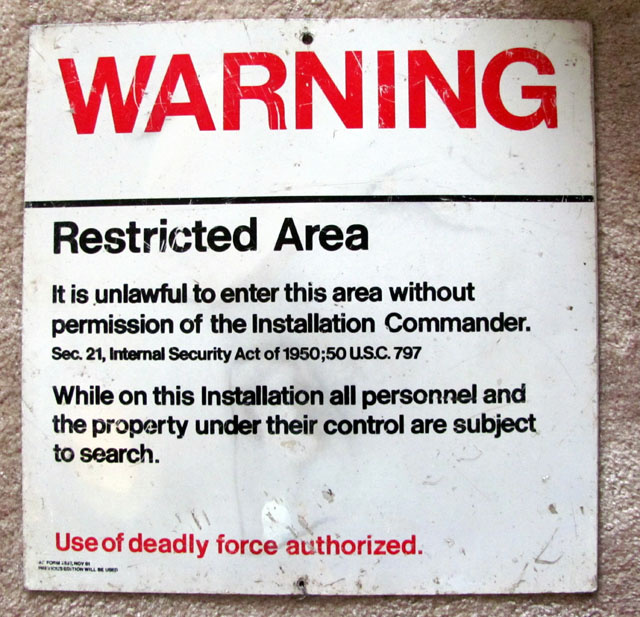
The height and width of the screenshot is (617, 640). Identify the location of carpet space to the right of sign. (619, 320).